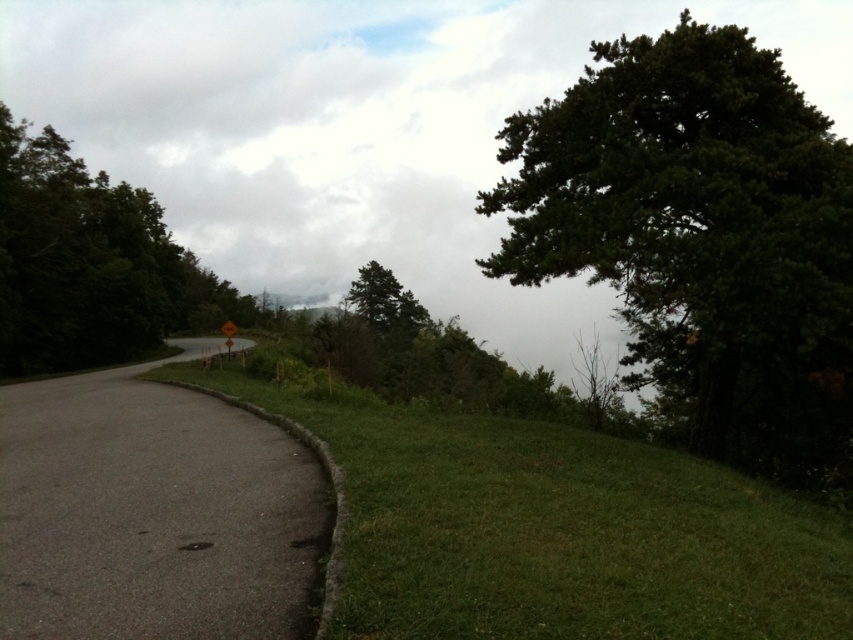
You are a drone operator trying to capture a photo of the green grassy area at lower left. According to the coordinates provided, where exactly should you position the camera to ensure the green grassy at lower left is centered in the frame?

The green grassy at lower left is located at point (553, 529), so you should position the camera to center the frame at those coordinates to capture it properly.

You are a drone operator trying to capture aerial footage of the rural road scene. You have two points marked on your map, point A at coordinates point (657,524) and point B at coordinates point (229,324). If you want to film the closest point to the camera first, which point should you start with?

Point point (657,524) is closer to the viewer than point point (229,324), so you should start filming point point (657,524) first.